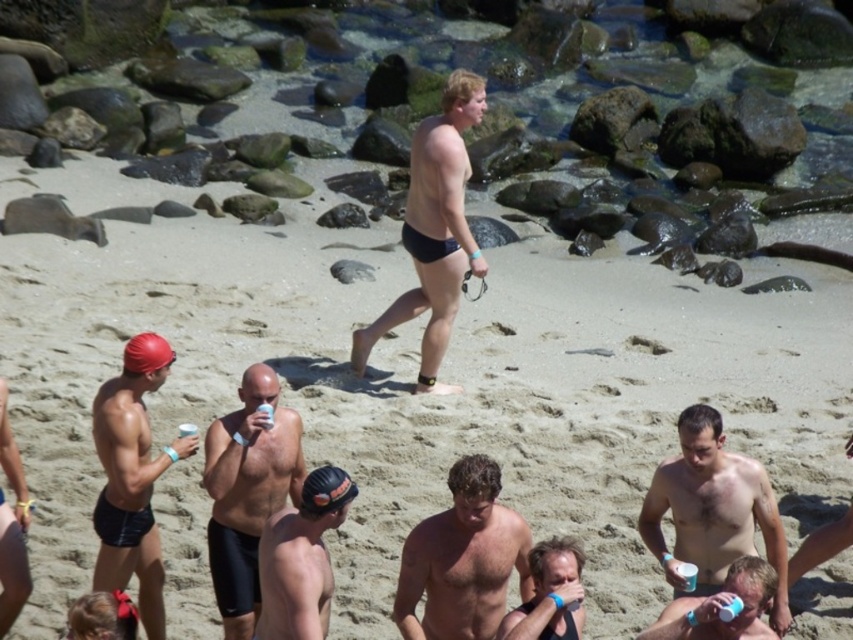
Question: Which object is positioned farthest from the matte plastic cup at lower center?

Choices:
 (A) black matte swim cap at center
 (B) smooth black swim cap at center
 (C) smooth skin torso at center
 (D) matte black swim cap at lower left

Answer: (D)

Question: Which point is farther to the camera?

Choices:
 (A) matte black swim cap at lower left
 (B) smooth black swim cap at center

Answer: (A)

Question: Which point is closer to the camera?

Choices:
 (A) smooth black swim cap at center
 (B) matte black swim cap at left

Answer: (B)

Question: Is smooth black swim cap at center below matte plastic cup at lower center?

Choices:
 (A) no
 (B) yes

Answer: (A)

Question: In this image, where is black matte swim cap at center located relative to matte plastic cup at lower center?

Choices:
 (A) below
 (B) above

Answer: (B)

Question: Where is black matte swim trunks at center located in relation to black matte swim cap at center in the image?

Choices:
 (A) below
 (B) above

Answer: (B)